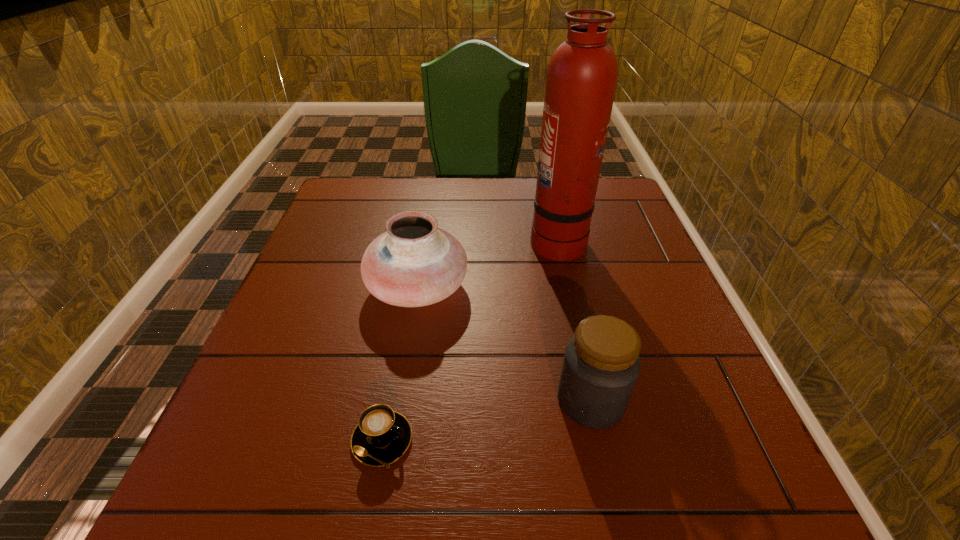
This screenshot has width=960, height=540. Find the location of `fire extinguisher`. fire extinguisher is located at coordinates (582, 74).

The height and width of the screenshot is (540, 960). I want to click on pottery, so click(414, 263).

You are a GUI agent. You are given a task and a screenshot of the screen. Output one action in this format:
    pyautogui.click(x=<x>, y=<y>)
    Task: Click on the jar
    The height and width of the screenshot is (540, 960).
    Given the screenshot: What is the action you would take?
    pyautogui.click(x=601, y=364)

Identify the location of the shortest object. The width and height of the screenshot is (960, 540). (382, 436).

You are a GUI agent. You are given a task and a screenshot of the screen. Output one action in this format:
    pyautogui.click(x=<x>, y=<y>)
    Task: Click on the free space located 0.200m on the label side of the fire extinguisher
    
    Given the screenshot: What is the action you would take?
    453,239

Identify the location of free space located 0.350m on the label side of the fire extinguisher. coord(396,239).

At what (x,y) coordinates should I click in order to perform the action: click on free space located on the label side of the fire extinguisher. Please return your answer as a coordinate pair (x, y). This screenshot has width=960, height=540. Looking at the image, I should click on (472, 239).

Image resolution: width=960 pixels, height=540 pixels. I want to click on blank space located 0.260m on the front of the pottery, so click(394, 440).

At what (x,y) coordinates should I click in order to perform the action: click on vacant space situated on the surface of the jar near the warning symbol. Please return your answer as a coordinate pair (x, y). Looking at the image, I should click on [513, 400].

Find the location of a particular element. vacant area located 0.110m on the surface of the jar near the warning symbol is located at coordinates (495, 400).